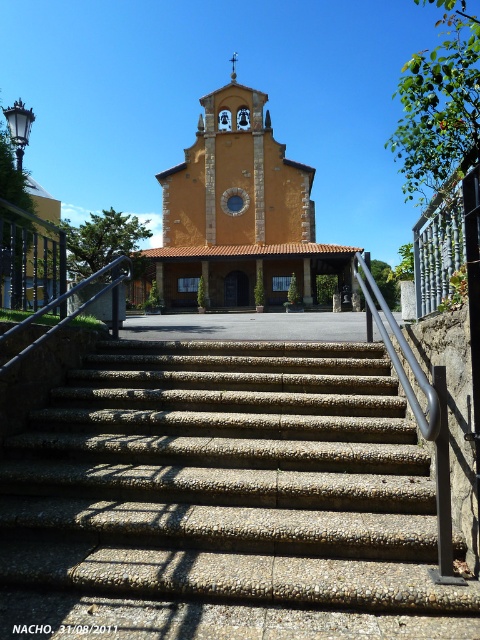
Is concrete textured stairs at center to the right of silver metallic handrail at center from the viewer's perspective?

Indeed, concrete textured stairs at center is positioned on the right side of silver metallic handrail at center.

Does concrete textured stairs at center have a smaller size compared to silver metallic handrail at center?

No, concrete textured stairs at center is not smaller than silver metallic handrail at center.

Find the location of a particular element. concrete textured stairs at center is located at coordinates (226, 480).

Is yellow stucco church at center shorter than silver metallic handrail at center?

No, yellow stucco church at center is not shorter than silver metallic handrail at center.

Can you confirm if yellow stucco church at center is bigger than silver metallic handrail at center?

Yes, yellow stucco church at center is bigger than silver metallic handrail at center.

Locate an element on the screen. yellow stucco church at center is located at coordinates (239, 211).

Between concrete textured stairs at center and yellow stucco church at center, which one is positioned lower?

concrete textured stairs at center is below.

Who is more distant from viewer, [365,435] or [172,257]?

The point [172,257] is behind.

Is point (408, 520) farther from viewer compared to point (199, 164)?

No.

Where is `concrete textured stairs at center`? concrete textured stairs at center is located at coordinates pyautogui.click(x=226, y=480).